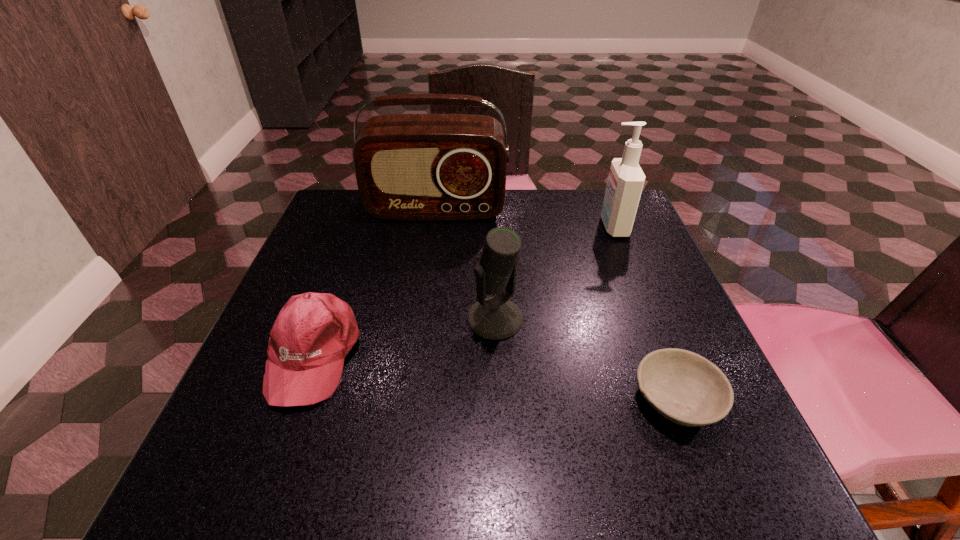
In order to click on vacant area in the image that satisfies the following two spatial constraints: 1. at the front of the fourth tallest object with the brim; 2. on the right side of the bowl in this screenshot , I will do `click(298, 399)`.

The image size is (960, 540). In order to click on free space that satisfies the following two spatial constraints: 1. on the front label of the cleansing agent; 2. on the front side of the shortest object in this screenshot , I will do `click(683, 399)`.

The width and height of the screenshot is (960, 540). Find the location of `vacant area that satisfies the following two spatial constraints: 1. at the front of the bowl with the brim; 2. on the left side of the baseball cap`. vacant area that satisfies the following two spatial constraints: 1. at the front of the bowl with the brim; 2. on the left side of the baseball cap is located at coordinates 298,399.

The width and height of the screenshot is (960, 540). Identify the location of vacant region that satisfies the following two spatial constraints: 1. on the front panel of the shortest object; 2. on the right side of the radio receiver. (410, 399).